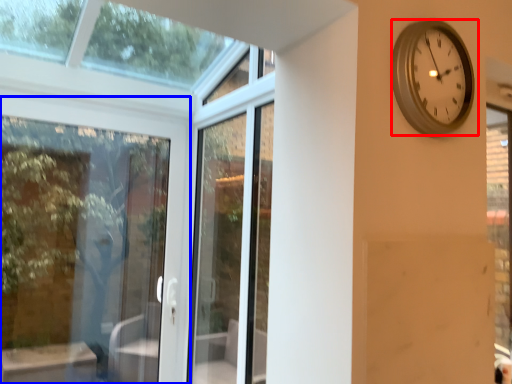
Question: Which object appears farthest to the camera in this image, wall clock (highlighted by a red box) or door (highlighted by a blue box)?

Choices:
 (A) wall clock
 (B) door

Answer: (B)